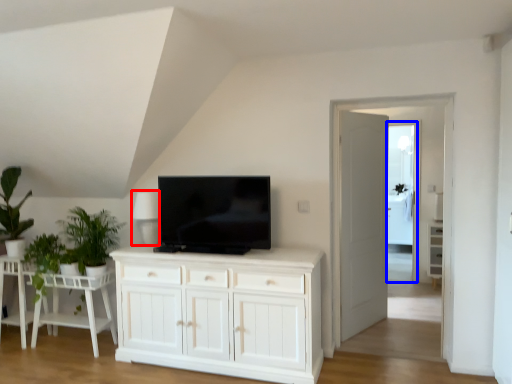
Question: Which of the following is the farthest to the observer, lamp (highlighted by a red box) or glass door (highlighted by a blue box)?

Choices:
 (A) lamp
 (B) glass door

Answer: (B)